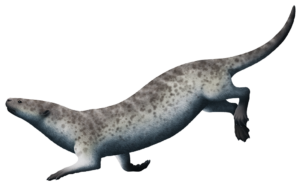
At what (x,y) coordinates should I click in order to perform the action: click on the chest. Please return your answer as a coordinate pair (x, y). The width and height of the screenshot is (300, 186). Looking at the image, I should click on (61, 141).